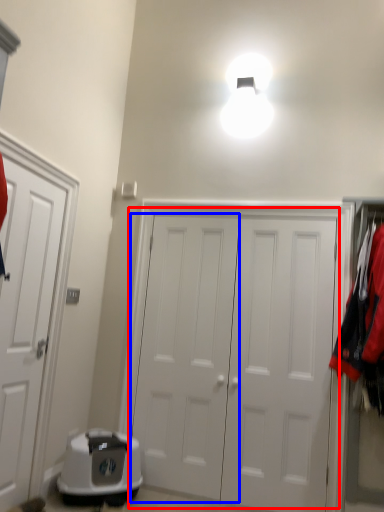
Question: Which of the following is the farthest to the observer, door (highlighted by a red box) or door (highlighted by a blue box)?

Choices:
 (A) door
 (B) door

Answer: (B)